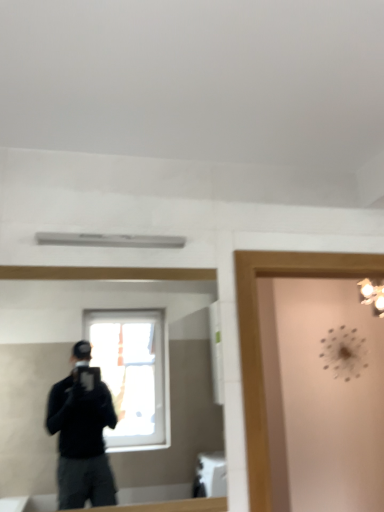
Question: Can you confirm if clear glass mirror at center is smaller than transparent glass door at upper right?

Choices:
 (A) no
 (B) yes

Answer: (B)

Question: From a real-world perspective, is clear glass mirror at center positioned over transparent glass door at upper right based on gravity?

Choices:
 (A) no
 (B) yes

Answer: (B)

Question: Is clear glass mirror at center aimed at transparent glass door at upper right?

Choices:
 (A) no
 (B) yes

Answer: (A)

Question: Does clear glass mirror at center have a lesser width compared to transparent glass door at upper right?

Choices:
 (A) no
 (B) yes

Answer: (B)

Question: Considering the relative sizes of clear glass mirror at center and transparent glass door at upper right in the image provided, is clear glass mirror at center bigger than transparent glass door at upper right?

Choices:
 (A) no
 (B) yes

Answer: (A)

Question: Is clear glass mirror at center at the left side of transparent glass door at upper right?

Choices:
 (A) yes
 (B) no

Answer: (A)

Question: Can we say transparent glass door at upper right lies outside clear glass mirror at center?

Choices:
 (A) yes
 (B) no

Answer: (A)

Question: From a real-world perspective, is transparent glass door at upper right located higher than clear glass mirror at center?

Choices:
 (A) yes
 (B) no

Answer: (B)

Question: Can you confirm if transparent glass door at upper right is smaller than clear glass mirror at center?

Choices:
 (A) no
 (B) yes

Answer: (A)

Question: Can you confirm if transparent glass door at upper right is thinner than clear glass mirror at center?

Choices:
 (A) yes
 (B) no

Answer: (B)

Question: Is transparent glass door at upper right closer to camera compared to clear glass mirror at center?

Choices:
 (A) yes
 (B) no

Answer: (B)

Question: Does transparent glass door at upper right have a greater height compared to clear glass mirror at center?

Choices:
 (A) no
 (B) yes

Answer: (B)

Question: Is clear glass mirror at center taller or shorter than transparent glass door at upper right?

Choices:
 (A) short
 (B) tall

Answer: (A)